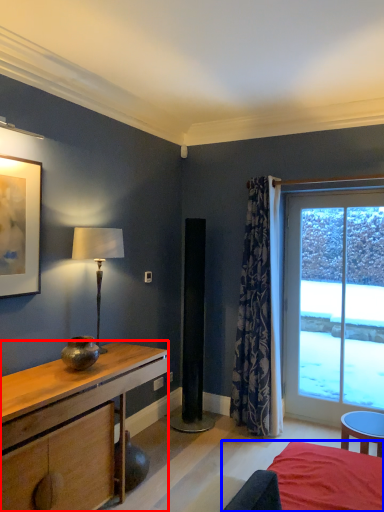
Question: Which of the following is the closest to the observer, desk (highlighted by a red box) or bed (highlighted by a blue box)?

Choices:
 (A) desk
 (B) bed

Answer: (B)